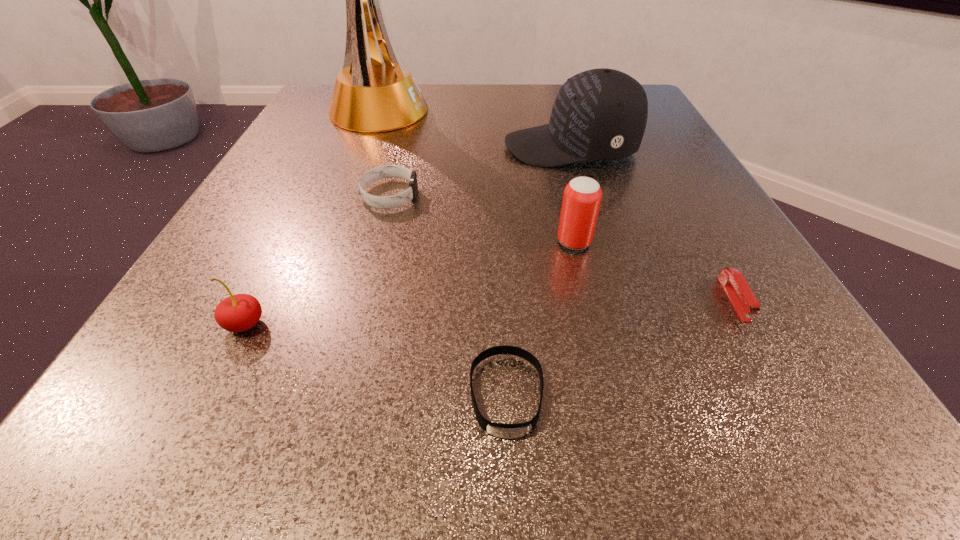
Where is `trophy`? The image size is (960, 540). trophy is located at coordinates (381, 95).

Where is `baseball cap`? The image size is (960, 540). baseball cap is located at coordinates (600, 114).

The image size is (960, 540). In order to click on beer can in this screenshot , I will do `click(582, 196)`.

Identify the location of cherry. Image resolution: width=960 pixels, height=540 pixels. 237,313.

Identify the location of the taller wristband. Image resolution: width=960 pixels, height=540 pixels. (386, 171).

Find the location of a particular element. This screenshot has width=960, height=540. the farther wristband is located at coordinates (386, 171).

You are a GUI agent. You are given a task and a screenshot of the screen. Output one action in this format:
    pyautogui.click(x=<x>, y=<y>)
    Task: Click on the stapler
    The width and height of the screenshot is (960, 540).
    Given the screenshot: What is the action you would take?
    pyautogui.click(x=742, y=298)

Locate an element on the screen. The height and width of the screenshot is (540, 960). the second shortest object is located at coordinates (742, 298).

Find the location of a particular element. This screenshot has width=960, height=540. the nearest object is located at coordinates (509, 431).

The image size is (960, 540). In order to click on the shorter wristband in this screenshot , I will do 509,431.